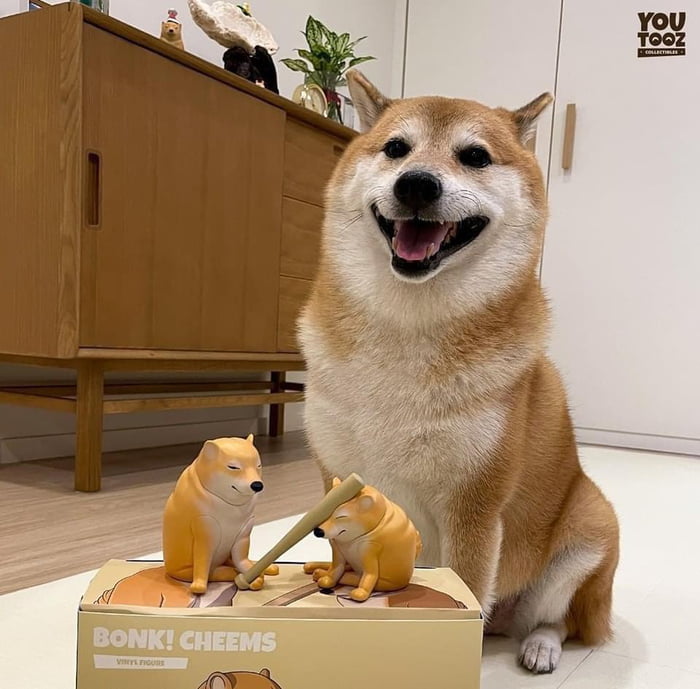
Locate an element on the screen. The height and width of the screenshot is (689, 700). cardboard box is located at coordinates (360, 652).